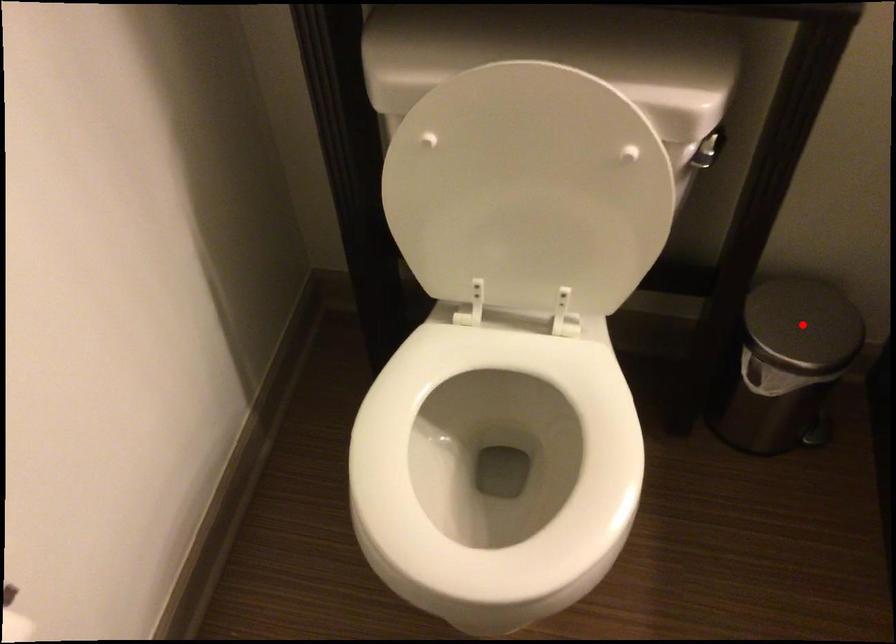
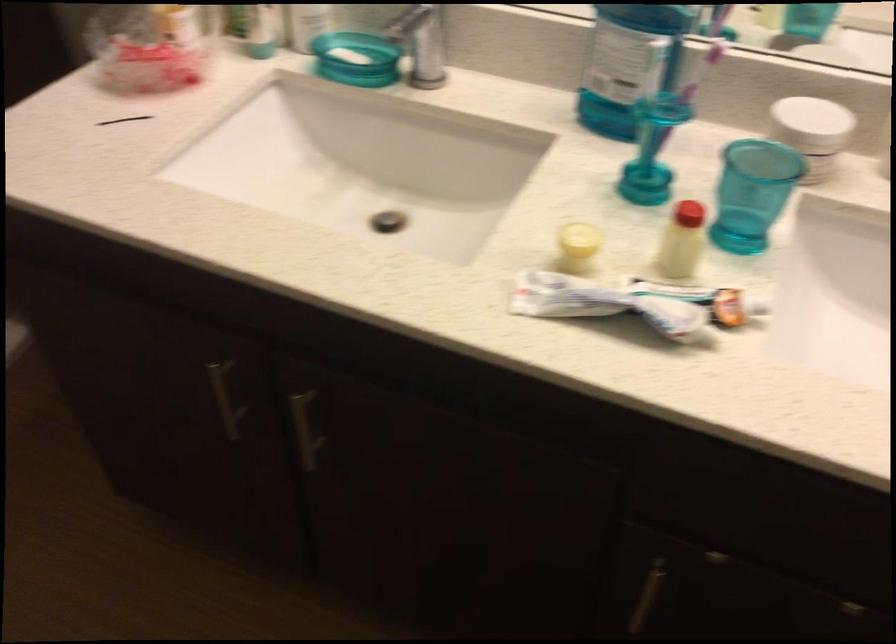
Question: I am providing you with two images of the same scene from different viewpoints. A red point is marked on the first image. Can you still see the location of the red point in image 2?

Choices:
 (A) Yes
 (B) No

Answer: (B)